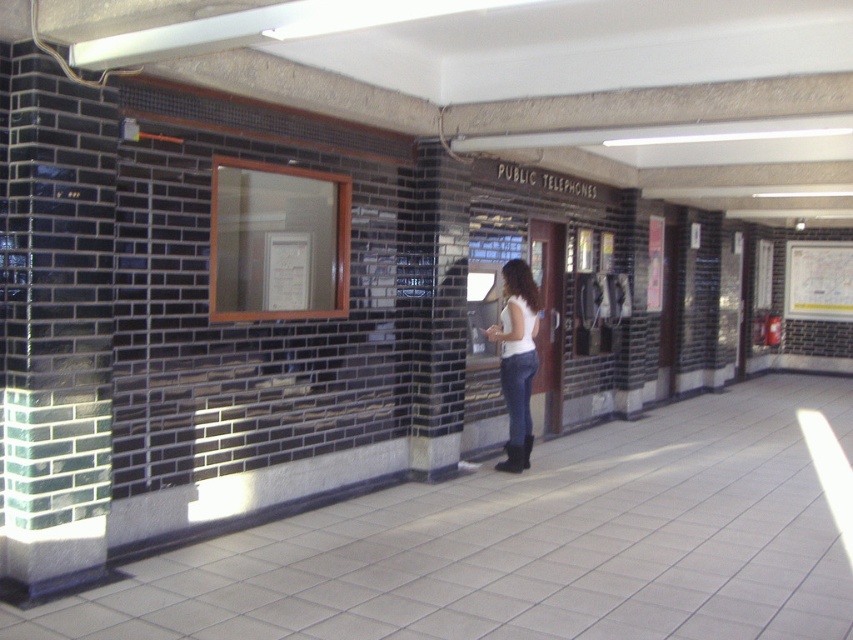
Consider the image. You are a maintenance worker needing to reach the public telephones on the right. You notice the black brick pillar at center and the white matte shirt at center in your path. Can you walk between them without touching either?

The black brick pillar at center and the white matte shirt at center are 23.19 inches apart from each other. Since 23.19 inches is approximately 1.93 feet, which is narrower than the average person, you would not be able to walk between them without touching either object.

You are a maintenance worker needing to reach a tool box placed between the green glossy pillar at left and the black brick pillar at center. The tool box requires a minimum of 10 feet of space to open safely. Based on the pillars spacing, will the tool box be able to open safely here?

The distance between the green glossy pillar at left and the black brick pillar at center is 9.86 feet, which is less than the required 10 feet. Therefore, the tool box will not have enough space to open safely here.